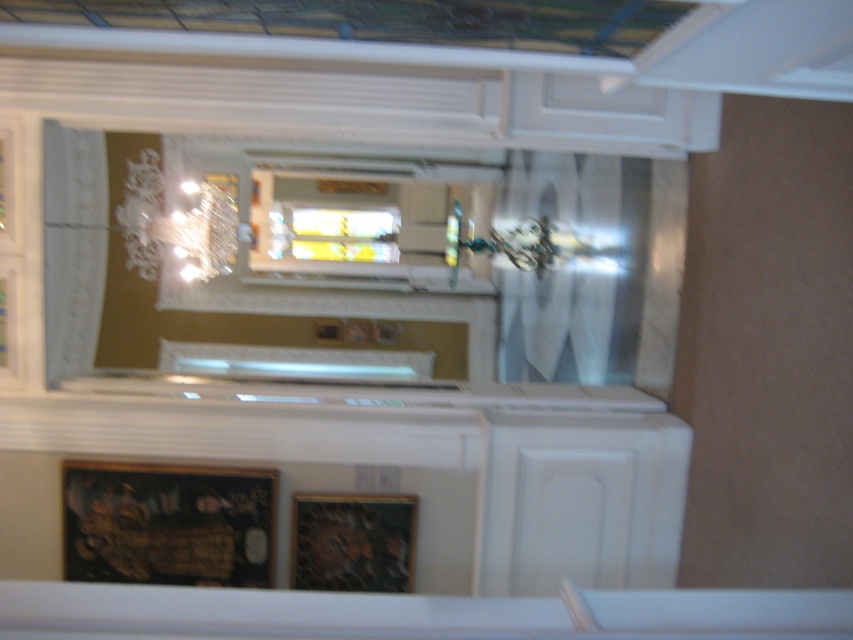
Question: Where is white sheer curtain at center located in relation to matte gold chandelier at upper left in the image?

Choices:
 (A) right
 (B) left

Answer: (A)

Question: From the image, what is the correct spatial relationship of matte gold chandelier at upper left in relation to clear glass window at center?

Choices:
 (A) above
 (B) below

Answer: (B)

Question: Among these objects, which one is nearest to the camera?

Choices:
 (A) matte gold chandelier at upper left
 (B) clear glass window at center
 (C) white sheer curtain at center

Answer: (C)

Question: Based on their relative distances, which object is farther from the white sheer curtain at center?

Choices:
 (A) matte gold chandelier at upper left
 (B) clear glass window at center

Answer: (A)

Question: Estimate the real-world distances between objects in this image. Which object is farther from the matte gold chandelier at upper left?

Choices:
 (A) white sheer curtain at center
 (B) clear glass window at center

Answer: (A)

Question: Is white sheer curtain at center thinner than clear glass window at center?

Choices:
 (A) yes
 (B) no

Answer: (A)